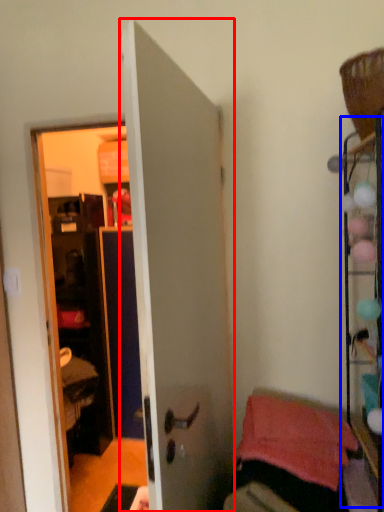
Question: Which object appears farthest to the camera in this image, door (highlighted by a red box) or shelf (highlighted by a blue box)?

Choices:
 (A) door
 (B) shelf

Answer: (B)